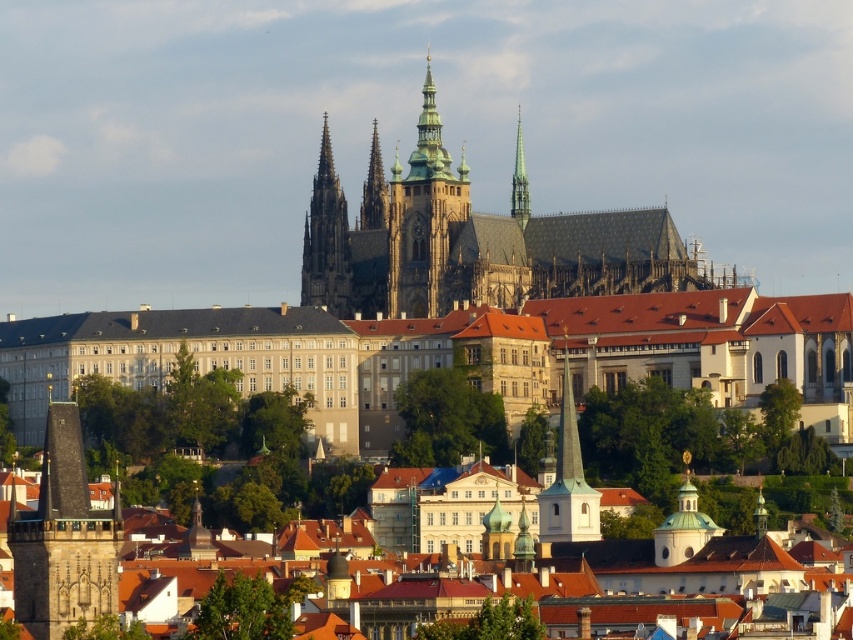
Question: Is golden spire at center closer to camera compared to green glass spire at upper center?

Choices:
 (A) yes
 (B) no

Answer: (B)

Question: Which of the following is the closest to the observer?

Choices:
 (A) green glass spire at upper center
 (B) dark gray stone castle at center
 (C) golden spire at center

Answer: (B)

Question: Is dark gray stone castle at center behind golden stone spire at center?

Choices:
 (A) no
 (B) yes

Answer: (A)

Question: Which point is closer to the camera taking this photo?

Choices:
 (A) (20, 580)
 (B) (521, 225)
 (C) (416, 148)

Answer: (A)

Question: Is green stone tower at center smaller than white stone tower at center?

Choices:
 (A) no
 (B) yes

Answer: (A)

Question: Which point is closer to the camera?

Choices:
 (A) golden spire at center
 (B) green stone tower at center
 (C) white stone tower at center
 (D) golden stone spire at center

Answer: (C)